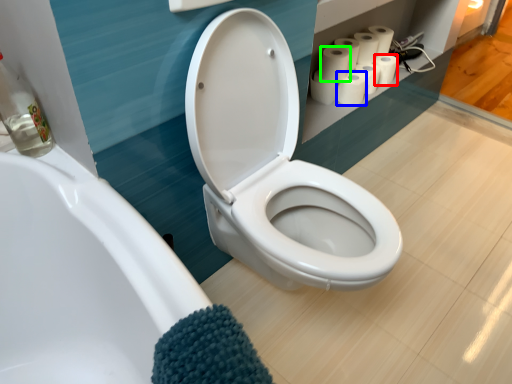
Question: Which is farther away from toilet paper (highlighted by a red box)? paper towel (highlighted by a blue box) or toilet paper (highlighted by a green box)?

Choices:
 (A) paper towel
 (B) toilet paper

Answer: (B)